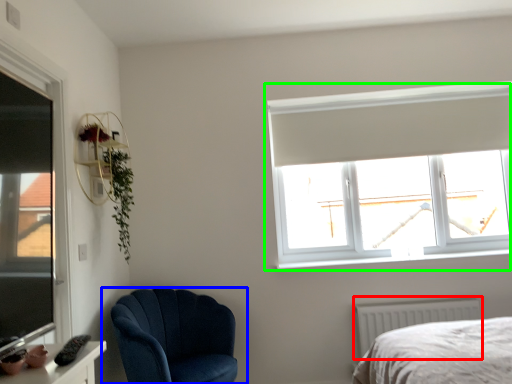
Question: Considering the real-world distances, which object is farthest from radiator (highlighted by a red box)? chair (highlighted by a blue box) or window (highlighted by a green box)?

Choices:
 (A) chair
 (B) window

Answer: (A)